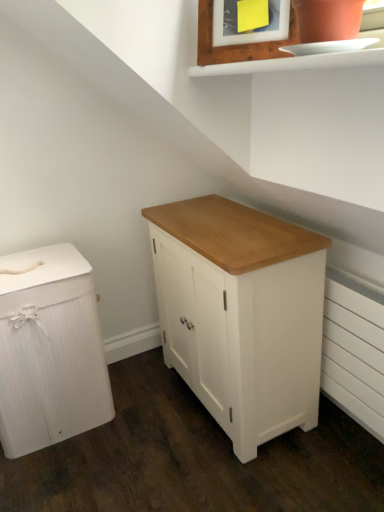
Question: Is wooden picture frame at upper center taller than white painted wood cabinet at center, the first chest of drawers viewed from the right?

Choices:
 (A) no
 (B) yes

Answer: (A)

Question: Is wooden picture frame at upper center positioned behind white painted wood cabinet at center, the first chest of drawers viewed from the right?

Choices:
 (A) yes
 (B) no

Answer: (B)

Question: Is wooden picture frame at upper center to the right of white painted wood cabinet at center, the first chest of drawers viewed from the right, from the viewer's perspective?

Choices:
 (A) no
 (B) yes

Answer: (B)

Question: Does wooden picture frame at upper center have a smaller size compared to white painted wood cabinet at center, the first chest of drawers viewed from the right?

Choices:
 (A) no
 (B) yes

Answer: (B)

Question: Is wooden picture frame at upper center touching white painted wood cabinet at center, marked as the second chest of drawers in a left-to-right arrangement?

Choices:
 (A) yes
 (B) no

Answer: (B)

Question: From a real-world perspective, is wooden picture frame at upper center under white painted wood cabinet at center, the first chest of drawers viewed from the right?

Choices:
 (A) no
 (B) yes

Answer: (A)

Question: From the image's perspective, does wooden picture frame at upper center appear lower than white painted radiator at lower right?

Choices:
 (A) yes
 (B) no

Answer: (B)

Question: Is wooden picture frame at upper center next to white painted radiator at lower right and touching it?

Choices:
 (A) yes
 (B) no

Answer: (B)

Question: Considering the relative positions of wooden picture frame at upper center and white painted radiator at lower right in the image provided, is wooden picture frame at upper center in front of white painted radiator at lower right?

Choices:
 (A) no
 (B) yes

Answer: (B)

Question: Is wooden picture frame at upper center at the left side of white painted radiator at lower right?

Choices:
 (A) yes
 (B) no

Answer: (A)

Question: From the image's perspective, does wooden picture frame at upper center appear higher than white painted radiator at lower right?

Choices:
 (A) no
 (B) yes

Answer: (B)

Question: Is white painted radiator at lower right surrounded by wooden picture frame at upper center?

Choices:
 (A) yes
 (B) no

Answer: (B)

Question: Does wooden picture frame at upper center have a greater width compared to white wood chest of drawers at left, which is the 1th chest of drawers in left-to-right order?

Choices:
 (A) yes
 (B) no

Answer: (B)